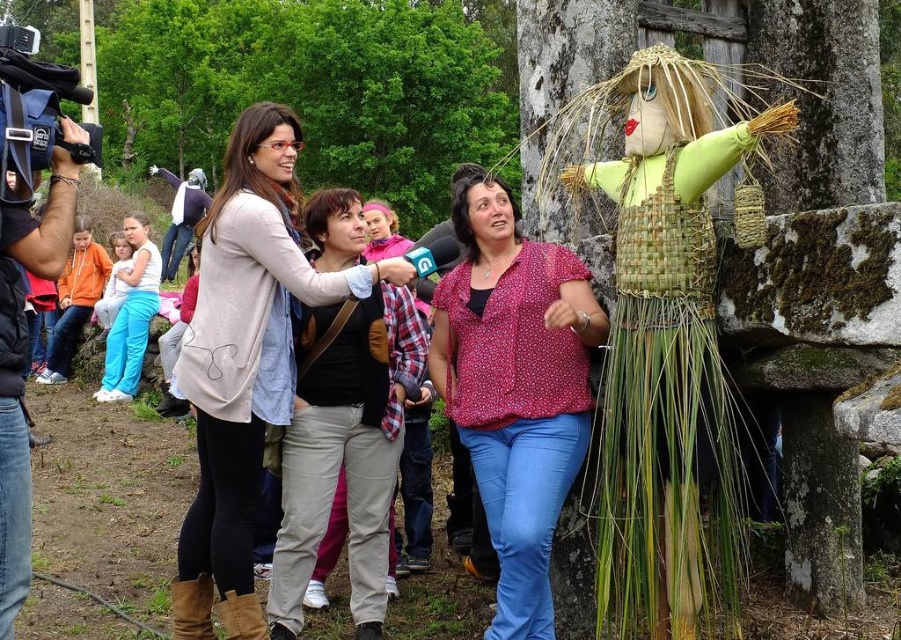
Describe the element at coordinates (246, 360) in the screenshot. I see `matte beige sweater at center` at that location.

Between matte beige sweater at center and floral blouse at center, which one appears on the right side from the viewer's perspective?

floral blouse at center is more to the right.

Who is more forward, (221, 262) or (579, 442)?

Positioned in front is point (579, 442).

What are the coordinates of `matte beige sweater at center` in the screenshot? It's located at (246, 360).